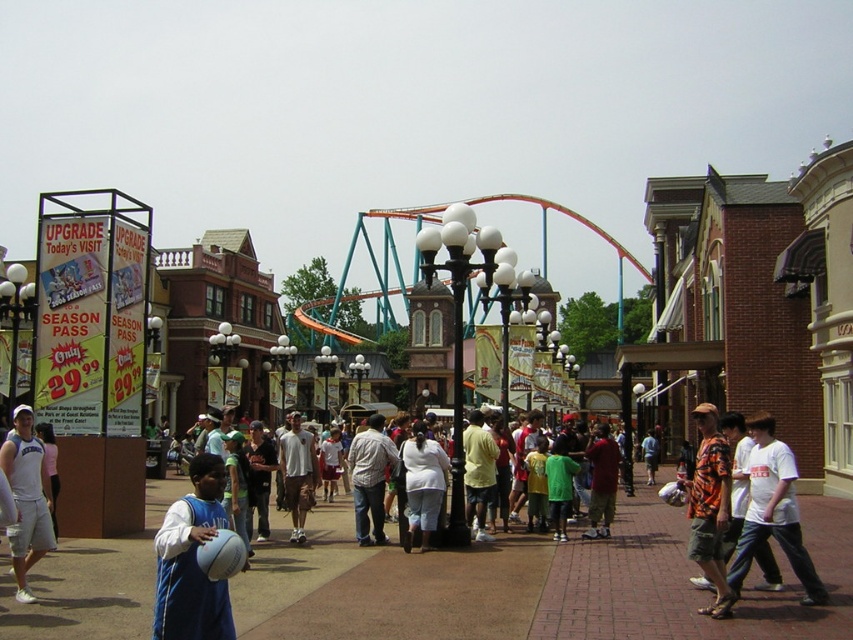
Question: Is white matte pants at center further to camera compared to white cotton shirt at center?

Choices:
 (A) no
 (B) yes

Answer: (A)

Question: Estimate the real-world distances between objects in this image. Which object is closer to the white cotton shirt at center?

Choices:
 (A) blue jersey at center
 (B) white matte pants at center

Answer: (B)

Question: Which object is closer to the camera taking this photo?

Choices:
 (A) white matte pants at center
 (B) orange printed shirt at center
 (C) matte red shirt at center
 (D) plaid shirt at center

Answer: (B)

Question: Observing the image, what is the correct spatial positioning of matte blue jersey at center in reference to white cotton shirt at center?

Choices:
 (A) right
 (B) left

Answer: (B)

Question: Which point appears farthest from the camera in this image?

Choices:
 (A) (618, 449)
 (B) (166, 605)

Answer: (A)

Question: Is white matte pants at center positioned behind matte red shirt at center?

Choices:
 (A) yes
 (B) no

Answer: (B)